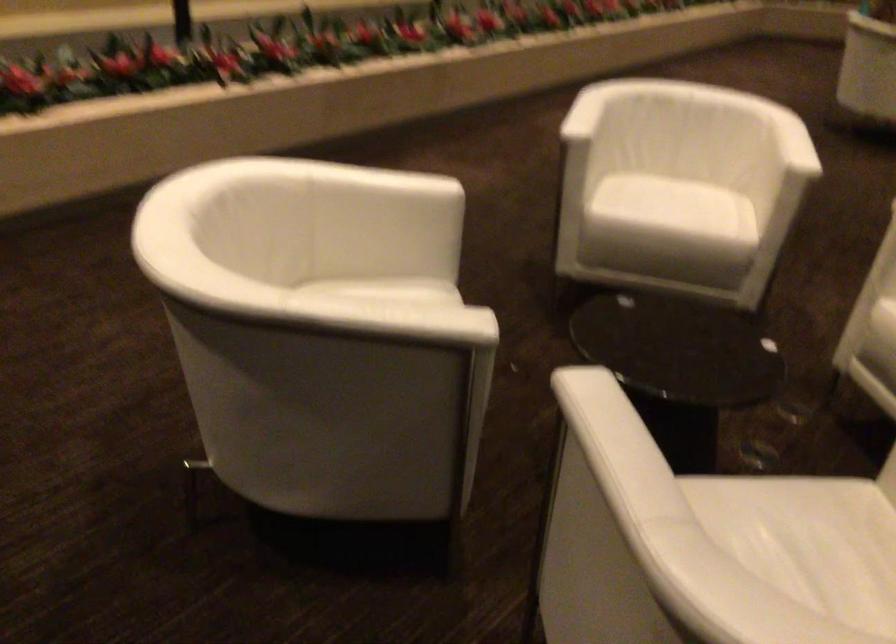
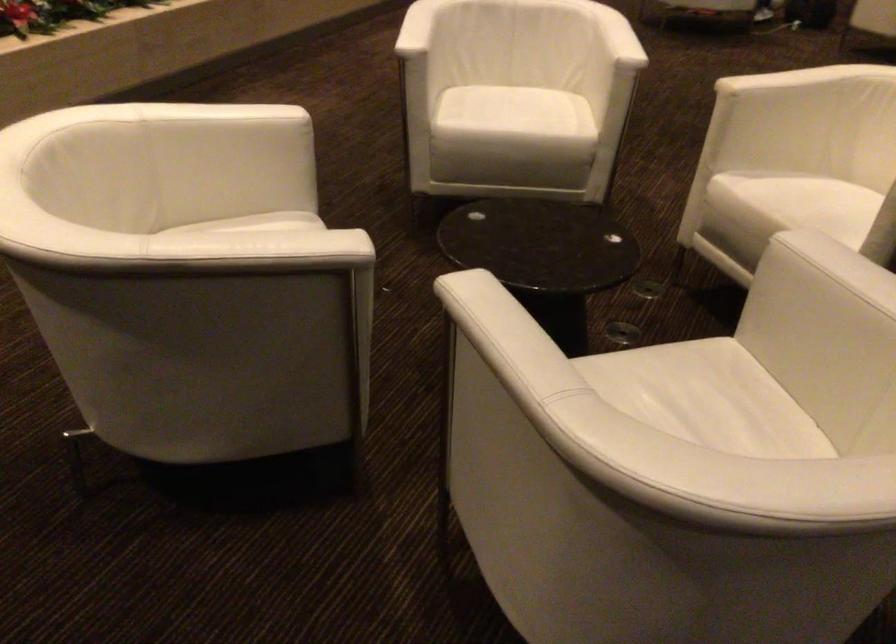
Find the pixel in the second image that matches pixel 402 286 in the first image.

(265, 223)